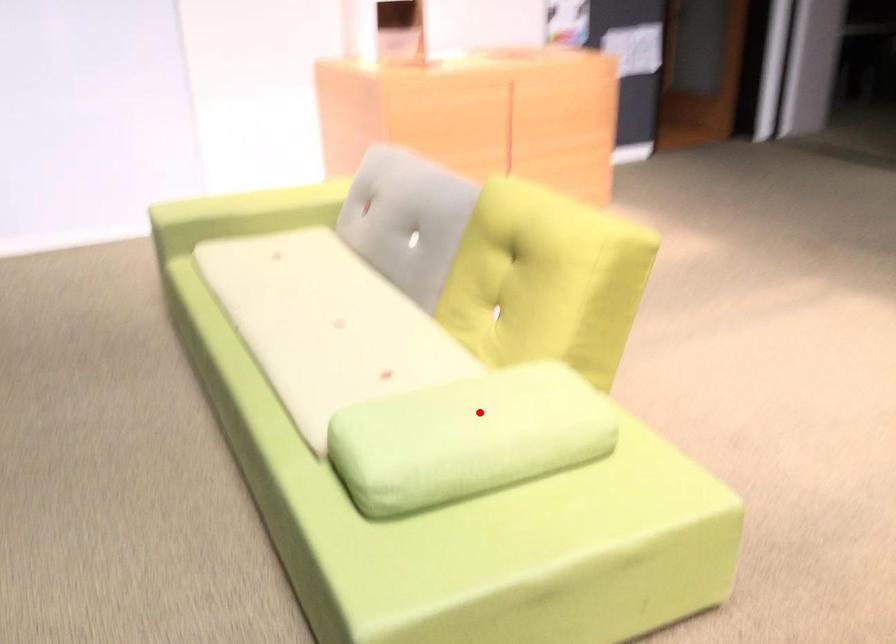
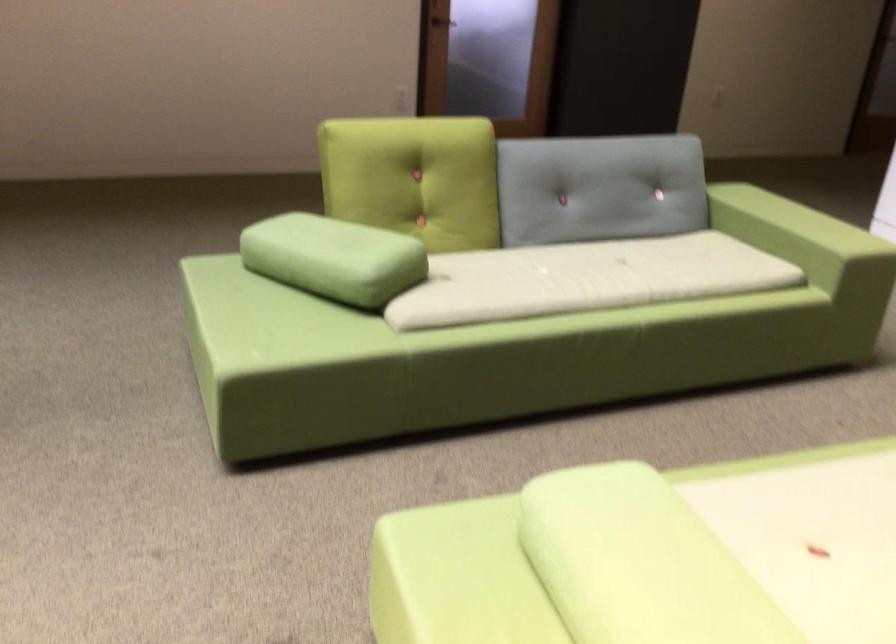
Question: I am providing you with two images of the same scene from different viewpoints. A red point is shown in image1. For the corresponding object point in image2, is it positioned nearer or farther from the camera?

Choices:
 (A) Nearer
 (B) Farther

Answer: (A)